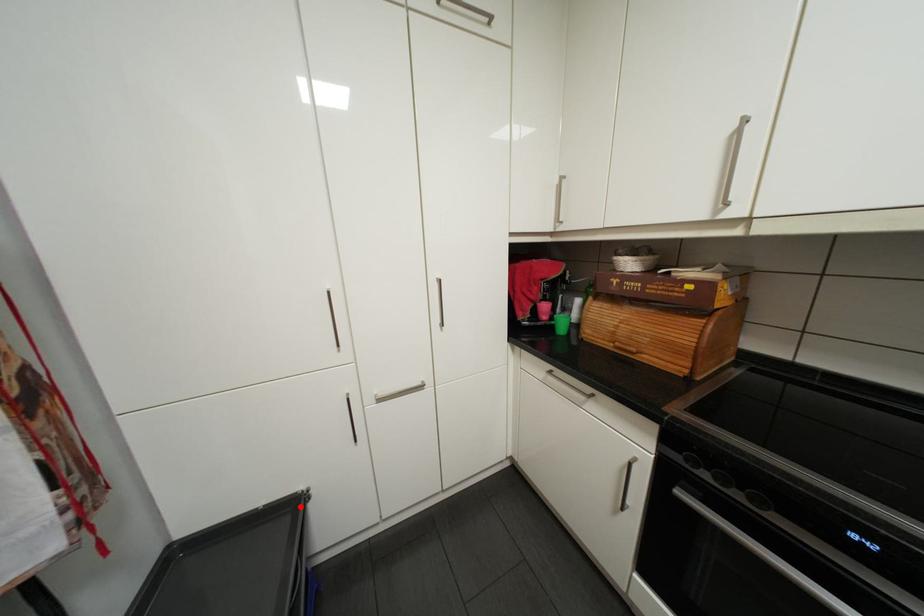
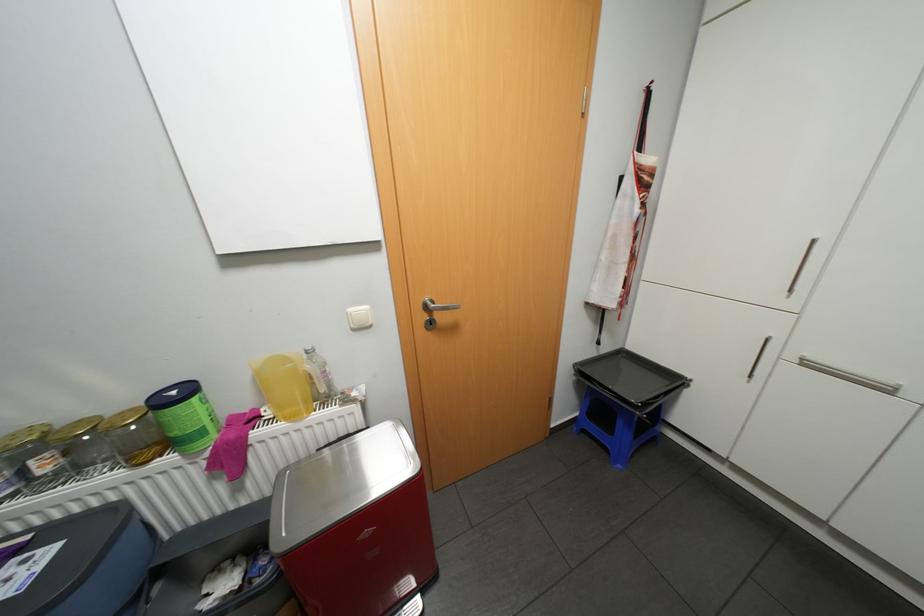
In the second image, find the point that corresponds to the highlighted location in the first image.

(684, 379)